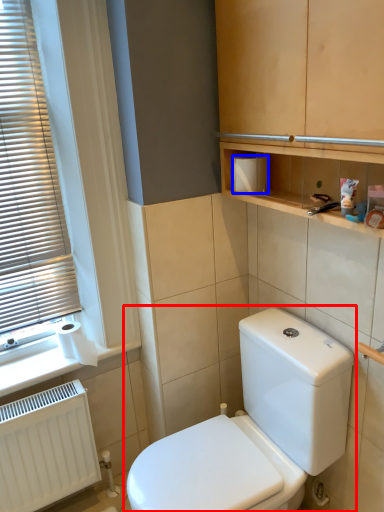
Question: Which point is further to the camera, toilet (highlighted by a red box) or toiletry box (highlighted by a blue box)?

Choices:
 (A) toilet
 (B) toiletry box

Answer: (B)